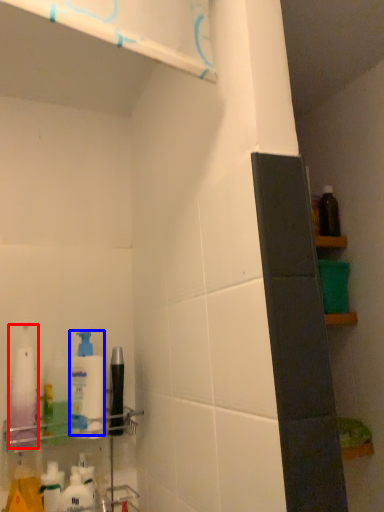
Question: Which object is further to the camera taking this photo, cleaning product (highlighted by a red box) or cleaning product (highlighted by a blue box)?

Choices:
 (A) cleaning product
 (B) cleaning product

Answer: (B)